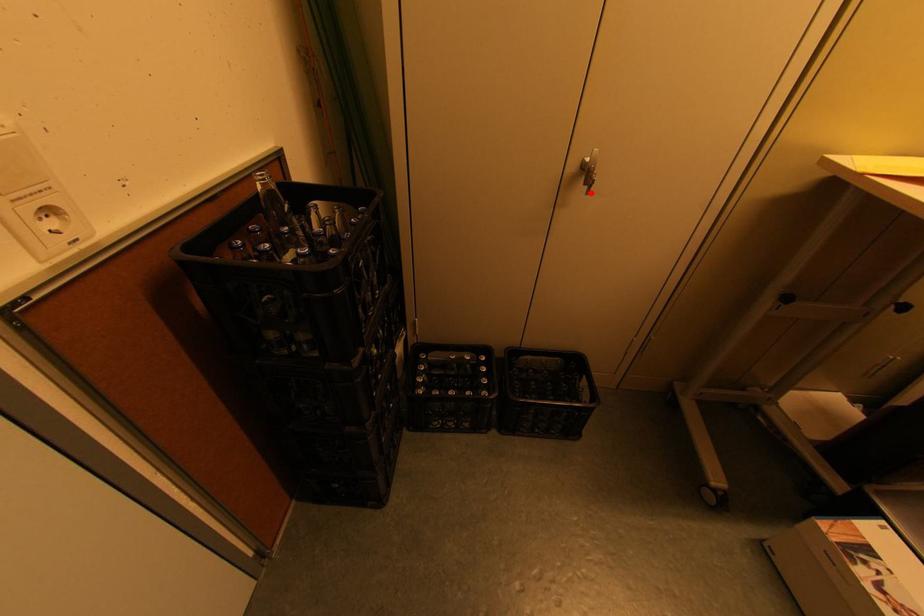
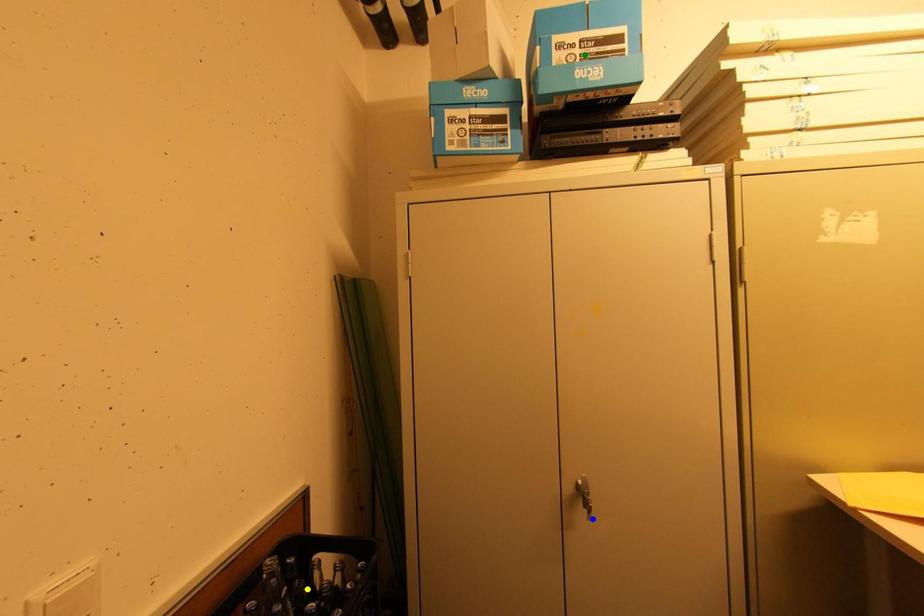
Question: I am providing you with two images of the same scene from different viewpoints. A red point is marked on the first image. You are given multiple points on the second image. In image 2, which mark is for the same physical point as the one in image 1?

Choices:
 (A) blue point
 (B) yellow point
 (C) green point

Answer: (A)